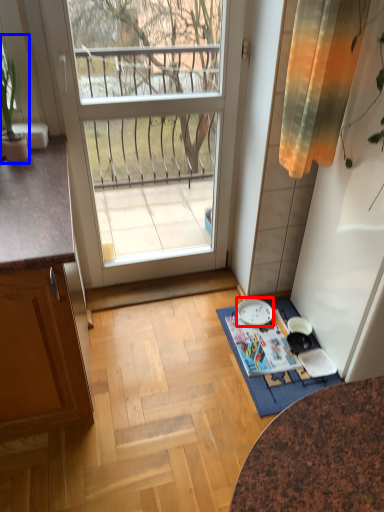
Question: Which point is further to the camera, plate (highlighted by a red box) or houseplant (highlighted by a blue box)?

Choices:
 (A) plate
 (B) houseplant

Answer: (A)